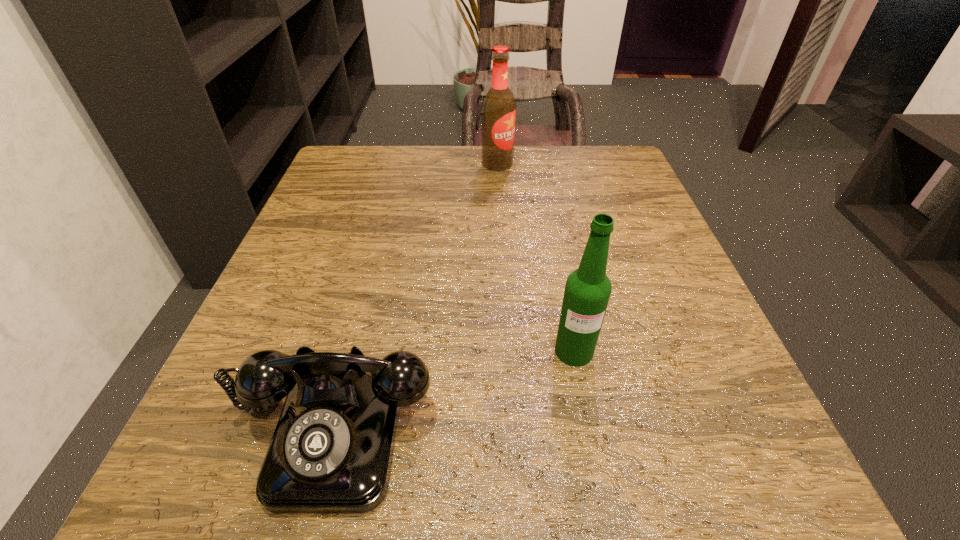
You are a GUI agent. You are given a task and a screenshot of the screen. Output one action in this format:
    pyautogui.click(x=<x>, y=<y>)
    Task: Click on the left beer bottle
    The height and width of the screenshot is (540, 960).
    Given the screenshot: What is the action you would take?
    pyautogui.click(x=499, y=106)

This screenshot has width=960, height=540. Identify the location of the farther beer bottle. (499, 106).

Locate an element on the screen. The width and height of the screenshot is (960, 540). the rightmost object is located at coordinates (587, 291).

At what (x,y) coordinates should I click in order to perform the action: click on the right beer bottle. Please return your answer as a coordinate pair (x, y). This screenshot has height=540, width=960. Looking at the image, I should click on (587, 291).

Identify the location of the shortest object. (331, 452).

This screenshot has width=960, height=540. I want to click on telephone, so click(331, 452).

At what (x,y) coordinates should I click in order to perform the action: click on free space located on the right of the farther beer bottle. Please return your answer as a coordinate pair (x, y). This screenshot has width=960, height=540. Looking at the image, I should click on (573, 164).

Find the location of a particular element. This screenshot has width=960, height=540. vacant position located 0.150m on the label of the nearer beer bottle is located at coordinates (598, 476).

The image size is (960, 540). Identify the location of object that is at the far edge. (499, 106).

The image size is (960, 540). I want to click on object that is at the near edge, so click(x=331, y=452).